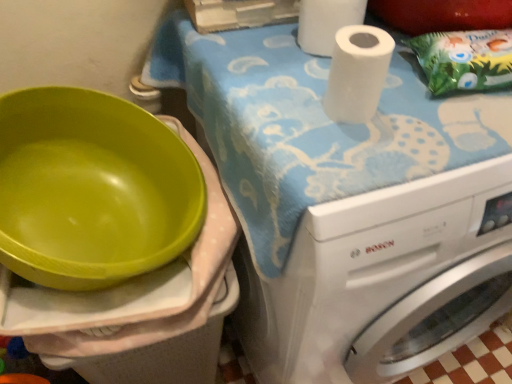
This screenshot has width=512, height=384. Identify the location of free area behind white matte paper towel at upper center, placed as the 1th paper towel when sorted from front to back. (306, 58).